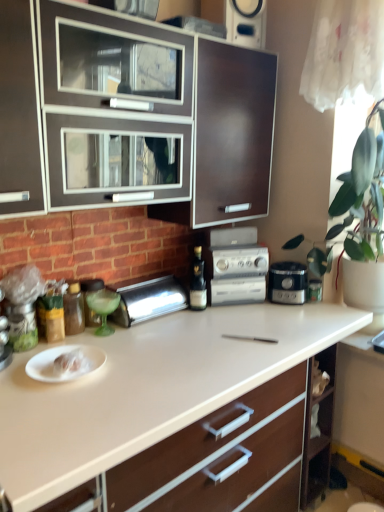
In order to click on free point in front of black glass bottle at center, which is the first bottle in right-to-left order in this screenshot , I will do `click(201, 324)`.